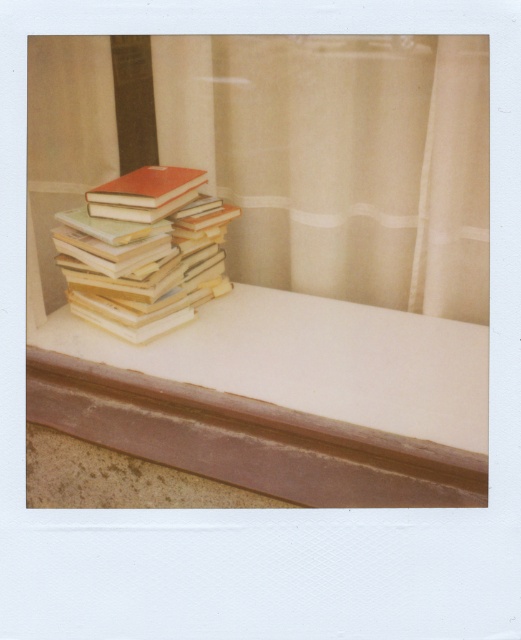
Question: Which point appears closest to the camera in this image?

Choices:
 (A) (x=390, y=86)
 (B) (x=102, y=257)
 (C) (x=312, y=378)

Answer: (C)

Question: Is white smooth window sill at center to the right of matte orange book at center from the viewer's perspective?

Choices:
 (A) no
 (B) yes

Answer: (B)

Question: Which object is positioned closest to the matte orange book at center?

Choices:
 (A) sheer beige curtain at upper center
 (B) white smooth window sill at center

Answer: (B)

Question: Is white smooth window sill at center below matte orange book at center?

Choices:
 (A) no
 (B) yes

Answer: (B)

Question: Considering the real-world distances, which object is closest to the matte orange book at center?

Choices:
 (A) white smooth window sill at center
 (B) sheer beige curtain at upper center

Answer: (A)

Question: Is sheer beige curtain at upper center wider than white smooth window sill at center?

Choices:
 (A) yes
 (B) no

Answer: (A)